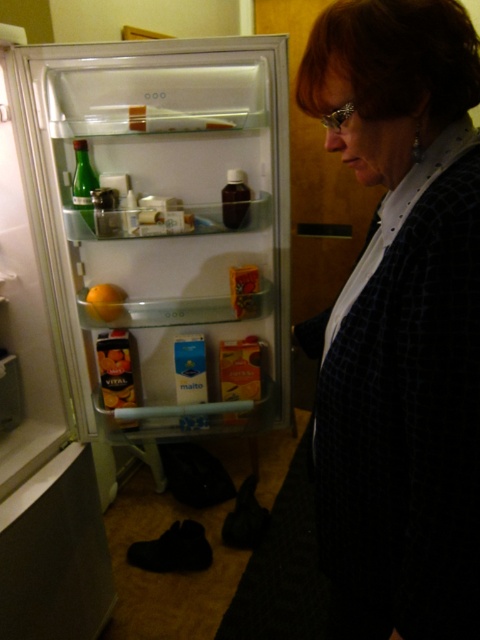
Which of these two, clear glass refrigerator at center or orange matte at left, stands shorter?

Standing shorter between the two is orange matte at left.

Locate an element on the screen. clear glass refrigerator at center is located at coordinates (163, 230).

Does clear glass refrigerator at center come behind dark blue textured sweater at center right?

That is True.

Who is lower down, clear glass refrigerator at center or dark blue textured sweater at center right?

Positioned lower is dark blue textured sweater at center right.

Who is more distant from viewer, [201,324] or [410,106]?

Positioned behind is point [201,324].

Image resolution: width=480 pixels, height=640 pixels. I want to click on clear glass refrigerator at center, so click(x=163, y=230).

Which is in front, point (469, 456) or point (97, 289)?

Point (469, 456) is in front.

Is point (396, 541) more distant than point (92, 292)?

No, (396, 541) is closer to viewer.

Find the location of a particular element. dark blue textured sweater at center right is located at coordinates (400, 323).